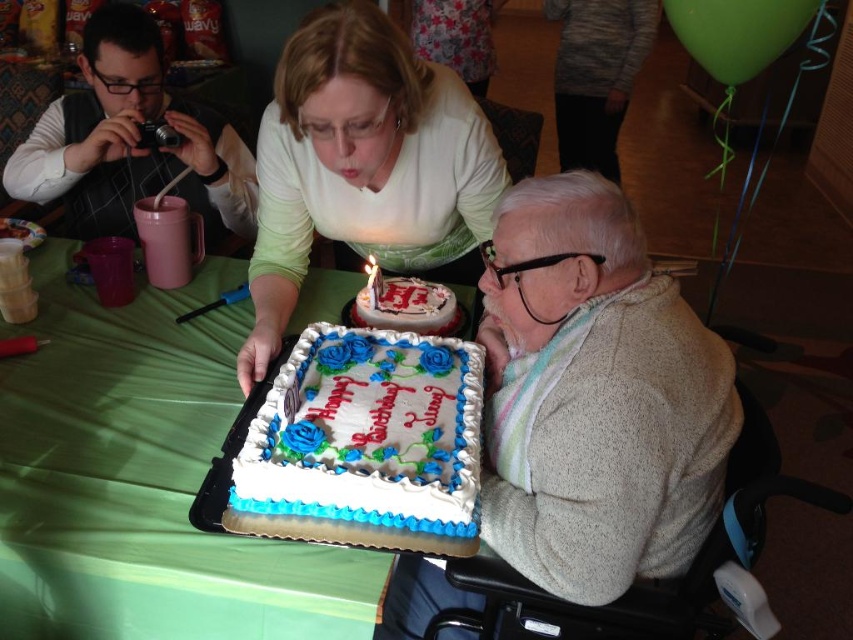
You are a photographer at the birthday party. You need to capture a photo of the white frosted cake at center and the matte black camera at upper left. Which object is shorter?

The white frosted cake at center is shorter than the matte black camera at upper left.

You are a photographer trying to capture a closeup of the white frosted cake with blue and green decorations at center without including the white textured sweater at lower right in the frame. Based on their positions, do you think this is possible?

The white textured sweater at lower right might be wider than the white frosted cake with blue and green decorations at center, so it might block the view. It depends on the exact width difference between them.